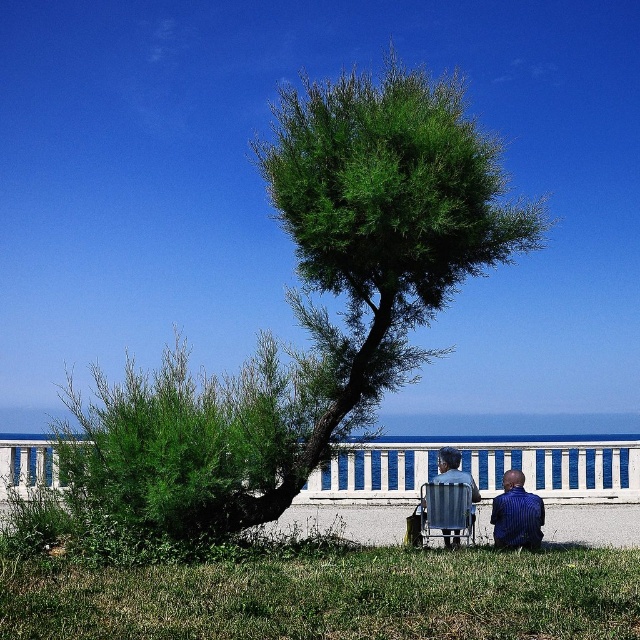
You are planning to install a small bench between the green leafy tree at center and the blue striped shirt at lower right. The bench requires a minimum of 10 feet of space between the two objects to be placed safely. Based on the scene description, is the available space sufficient?

The green leafy tree at center and blue striped shirt at lower right are 13.46 feet apart from each other. Since the required minimum space is 10 feet, the available space of 13.46 feet is sufficient for placing the bench safely.

You are planning to take a photo of the green leafy tree at center and the metallic silver beach chair at lower center from a distance. Which object would appear smaller in the photo?

The green leafy tree at center would appear smaller in the photo because it is physically smaller than the metallic silver beach chair at lower center.

From the picture: You are planning to set up a small picnic blanket between the green leafy tree at center and the metallic silver beach chair at lower center. The picnic blanket is 10 feet long. Will the blanket fit entirely between the two objects without overlapping either?

The distance between the green leafy tree at center and the metallic silver beach chair at lower center is 11.34 feet. Since the picnic blanket is 10 feet long, it will fit entirely between the two objects with some space to spare.